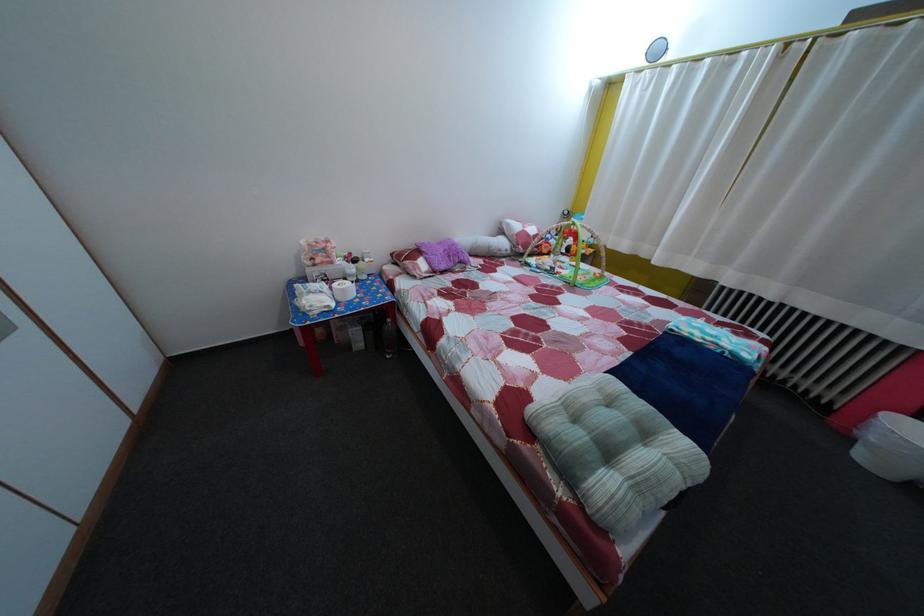
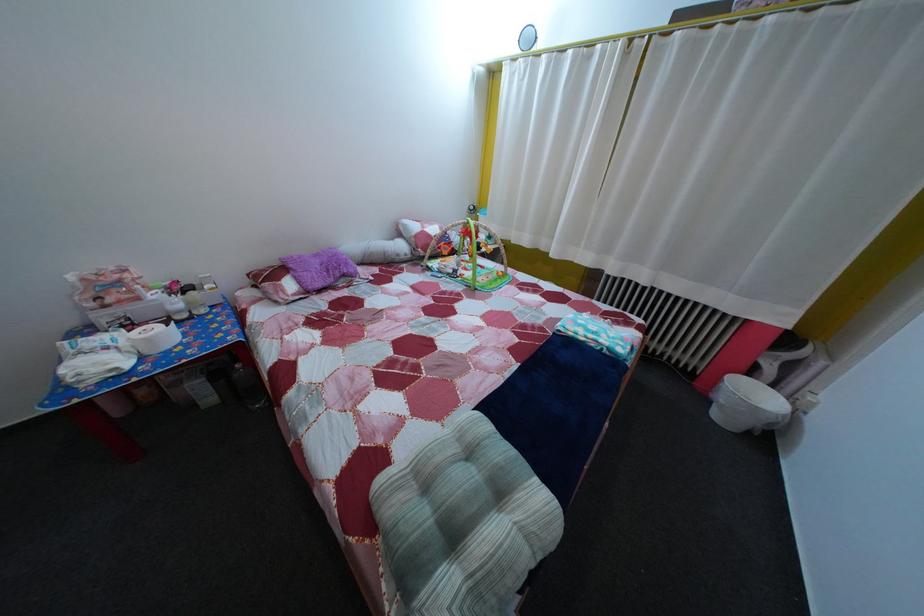
Locate, in the second image, the point that corresponds to point (691, 334) in the first image.

(578, 334)